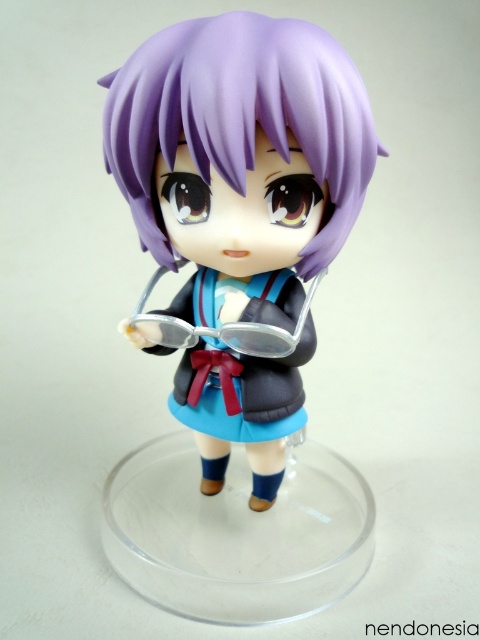
In the scene shown: Who is more forward, (284,32) or (298,387)?

Point (284,32)

Is matte purple hair at center positioned in front of matte plastic school uniform at center?

Yes, matte purple hair at center is closer to the viewer.

Locate an element on the screen. The height and width of the screenshot is (640, 480). matte purple hair at center is located at coordinates (240, 157).

In order to click on matte purple hair at center in this screenshot , I will do `click(240, 157)`.